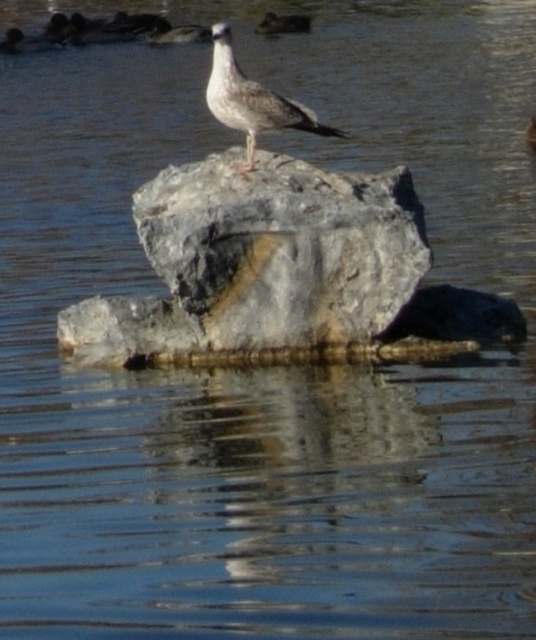
Question: Observing the image, what is the correct spatial positioning of gray/rough rock at center in reference to gray feathered seagull at center?

Choices:
 (A) below
 (B) above

Answer: (A)

Question: Is gray/rough rock at center positioned behind gray feathered seagull at center?

Choices:
 (A) no
 (B) yes

Answer: (A)

Question: Does gray/rough rock at center have a larger size compared to gray feathered seagull at center?

Choices:
 (A) yes
 (B) no

Answer: (A)